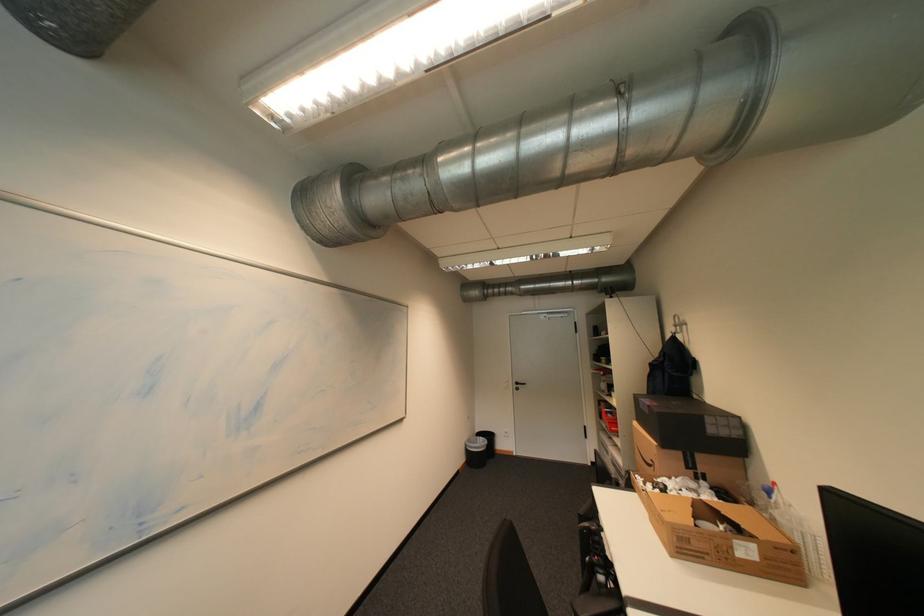
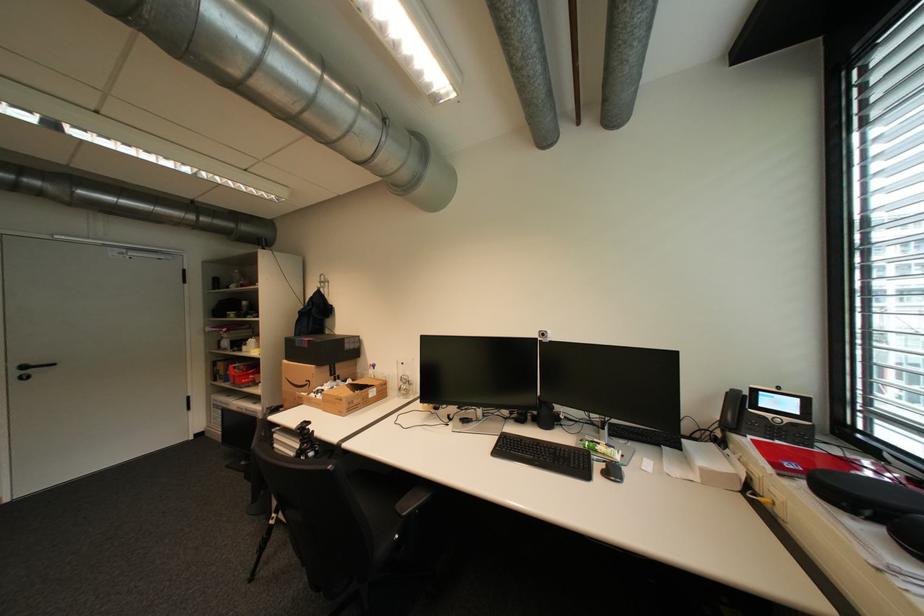
Where in the second image is the point corresponding to point 526,384 from the first image?

(32, 368)